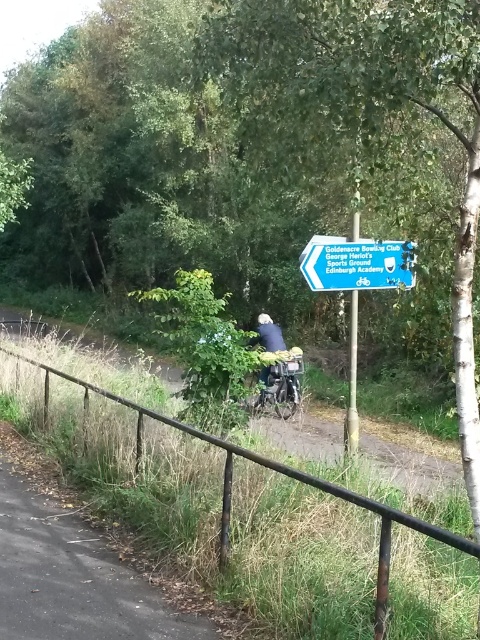
Is black metal fence at lower left taller than shiny metallic bicycle at center?

Indeed, black metal fence at lower left has a greater height compared to shiny metallic bicycle at center.

Is black metal fence at lower left shorter than shiny metallic bicycle at center?

In fact, black metal fence at lower left may be taller than shiny metallic bicycle at center.

Image resolution: width=480 pixels, height=640 pixels. I want to click on black metal fence at lower left, so click(251, 516).

In the scene shown: Between green plastic signpost at upper center and shiny metallic bicycle at center, which one appears on the left side from the viewer's perspective?

shiny metallic bicycle at center

Is point (324, 259) closer to viewer compared to point (291, 362)?

Yes, it is in front of point (291, 362).

At what (x,y) coordinates should I click in order to perform the action: click on green plastic signpost at upper center. Please return your answer as a coordinate pair (x, y). Looking at the image, I should click on (357, 262).

What do you see at coordinates (280, 384) in the screenshot? I see `shiny metallic bicycle at center` at bounding box center [280, 384].

Where is `shiny metallic bicycle at center`? The height and width of the screenshot is (640, 480). shiny metallic bicycle at center is located at coordinates click(280, 384).

Find the location of a particular element. This screenshot has width=480, height=640. shiny metallic bicycle at center is located at coordinates (280, 384).